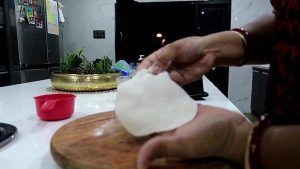
The height and width of the screenshot is (169, 300). In order to click on gold bowl in this screenshot , I will do click(93, 82).